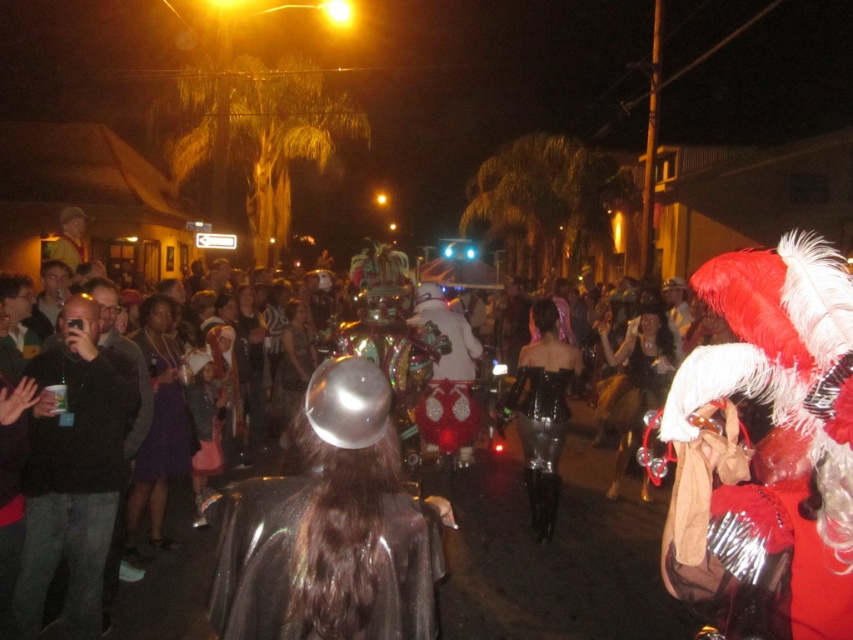
Question: Which is farther from the white matte costume at center?

Choices:
 (A) shiny black dress at center
 (B) shiny metallic helmet at center
 (C) purple satin dress at center
 (D) shiny metallic costume at center

Answer: (D)

Question: Does shiny metallic costume at center appear on the left side of shiny black dress at center?

Choices:
 (A) yes
 (B) no

Answer: (A)

Question: Is white matte costume at center in front of purple satin dress at center?

Choices:
 (A) no
 (B) yes

Answer: (A)

Question: Which object appears farthest from the camera in this image?

Choices:
 (A) purple satin dress at center
 (B) shiny metallic helmet at center
 (C) white matte costume at center
 (D) shiny metallic costume at center

Answer: (C)

Question: Estimate the real-world distances between objects in this image. Which object is farther from the shiny metallic helmet at center?

Choices:
 (A) purple satin dress at center
 (B) shiny black dress at center
 (C) shiny metallic costume at center
 (D) white matte costume at center

Answer: (D)

Question: Is shiny metallic costume at center below white matte costume at center?

Choices:
 (A) no
 (B) yes

Answer: (A)